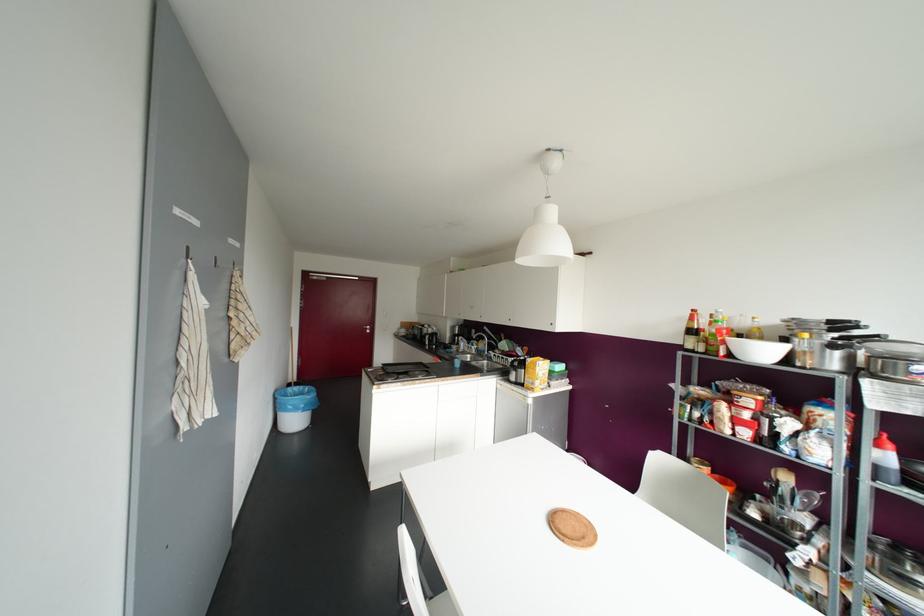
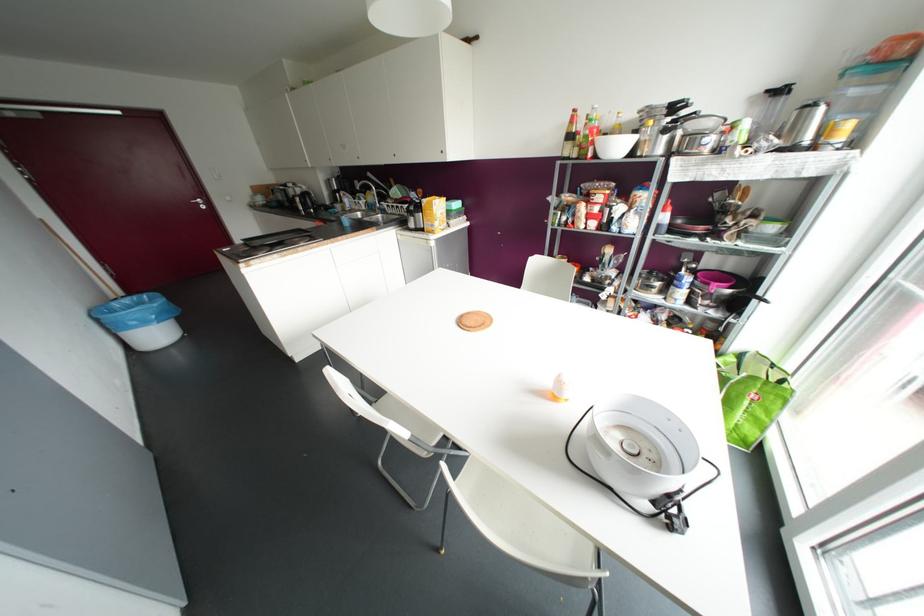
The point at [297,387] is marked in the first image. Where is the corresponding point in the second image?

(127, 300)